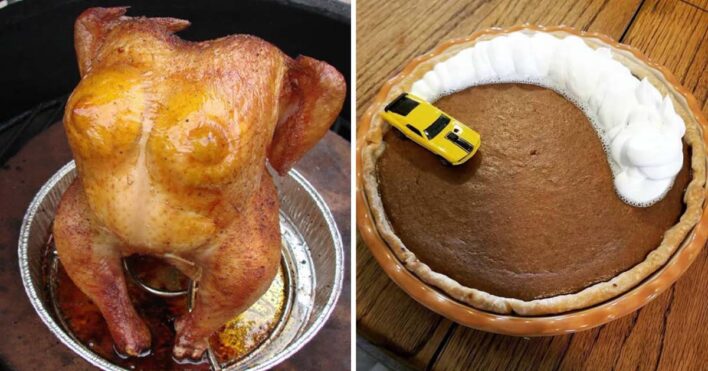
This screenshot has width=708, height=371. Identify the location of windows. (413, 134), (405, 105), (439, 129).